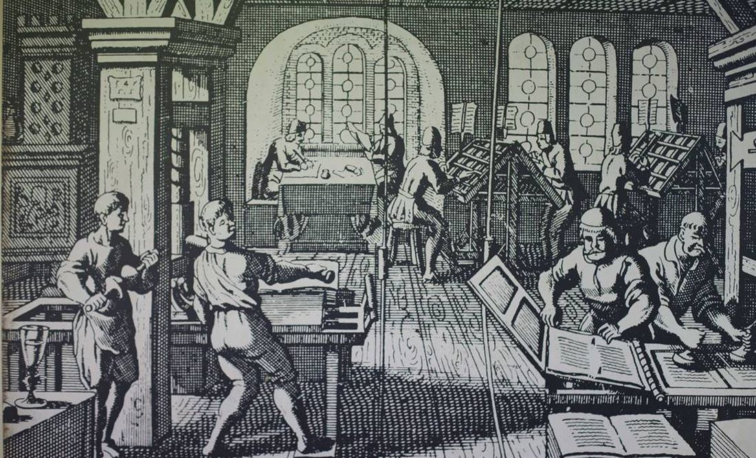
Locate an element on the screen. The width and height of the screenshot is (756, 458). wood floor is located at coordinates (395, 372).